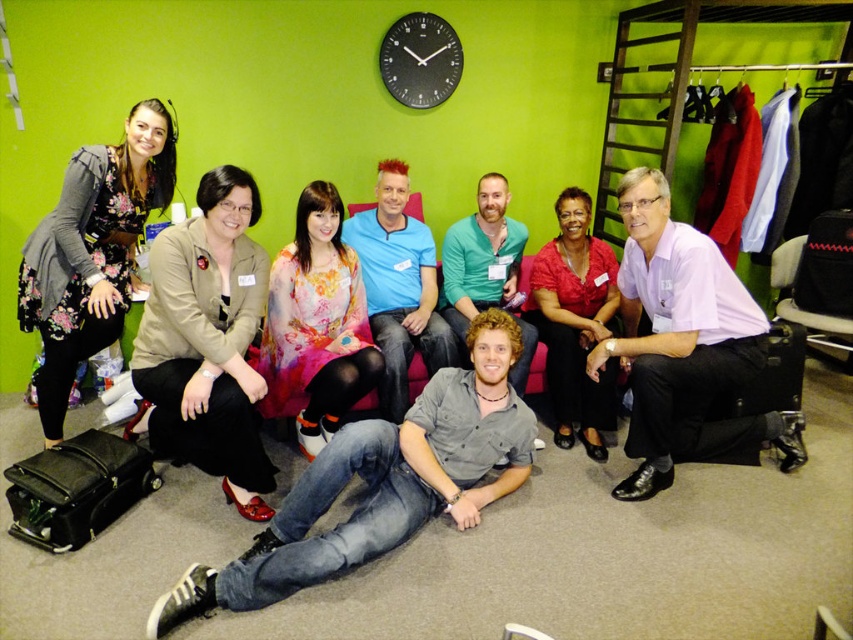
Question: Which is farther from the floral dress at left?

Choices:
 (A) black matte clock at upper center
 (B) blue cotton shirt at center
 (C) light purple cotton shirt at center right
 (D) jeans at center

Answer: (C)

Question: Is light purple cotton shirt at center right further to camera compared to teal matte shirt at center?

Choices:
 (A) no
 (B) yes

Answer: (A)

Question: Is light purple cotton shirt at center right to the right of black matte clock at upper center from the viewer's perspective?

Choices:
 (A) no
 (B) yes

Answer: (B)

Question: Which point is farther to the camera?

Choices:
 (A) (502, 310)
 (B) (270, 483)

Answer: (A)

Question: Estimate the real-world distances between objects in this image. Which object is closer to the matte beige blazer at center?

Choices:
 (A) blue cotton shirt at center
 (B) jeans at center
 (C) teal matte shirt at center
 (D) light purple cotton shirt at center right

Answer: (B)

Question: Does matte beige blazer at center lie behind matte red blouse at center?

Choices:
 (A) no
 (B) yes

Answer: (A)